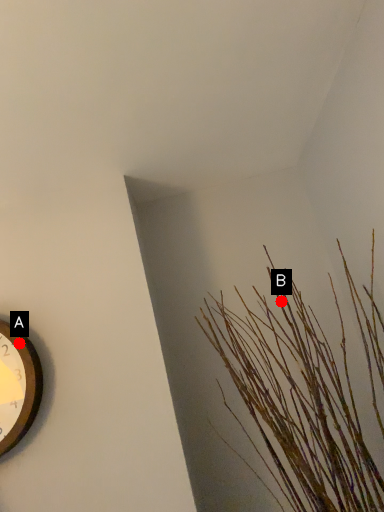
Question: Two points are circled on the image, labeled by A and B beside each circle. Which point is farther from the camera taking this photo?

Choices:
 (A) A is further
 (B) B is further

Answer: (B)